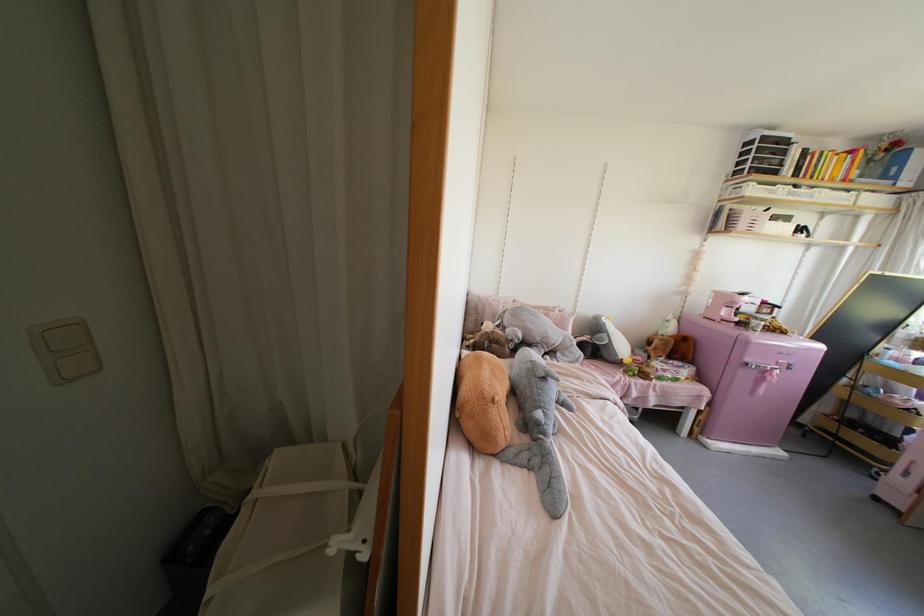
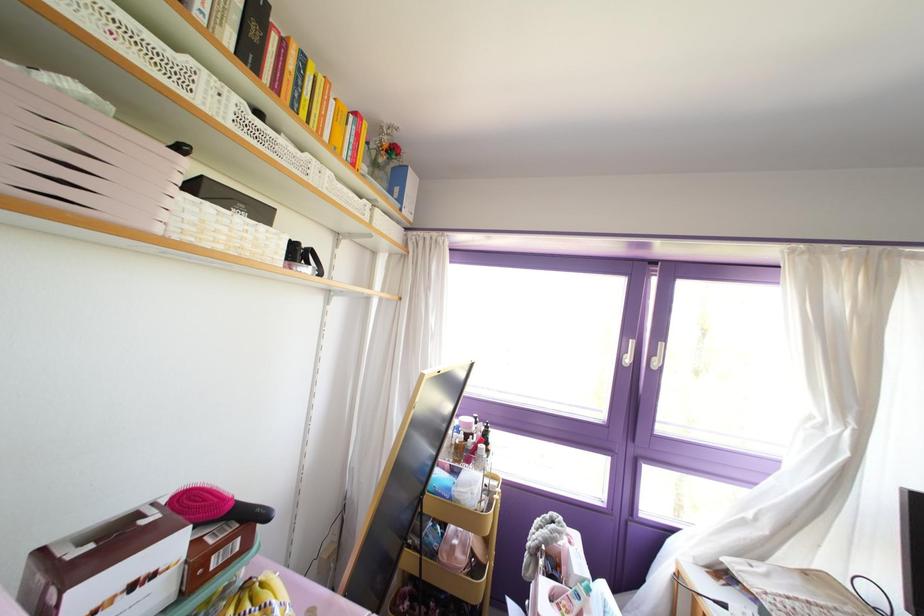
Find the pixel in the second image that matches [845,179] in the first image.

(351, 164)